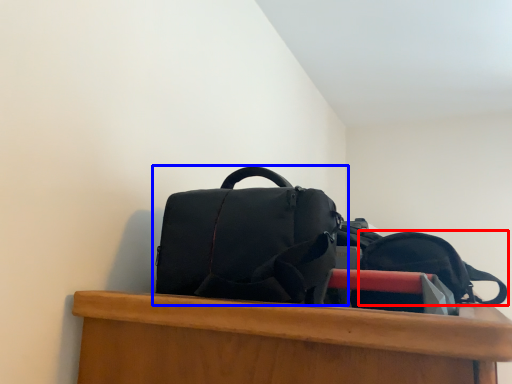
Question: Which point is closer to the camera, backpack (highlighted by a red box) or backpack (highlighted by a blue box)?

Choices:
 (A) backpack
 (B) backpack

Answer: (B)